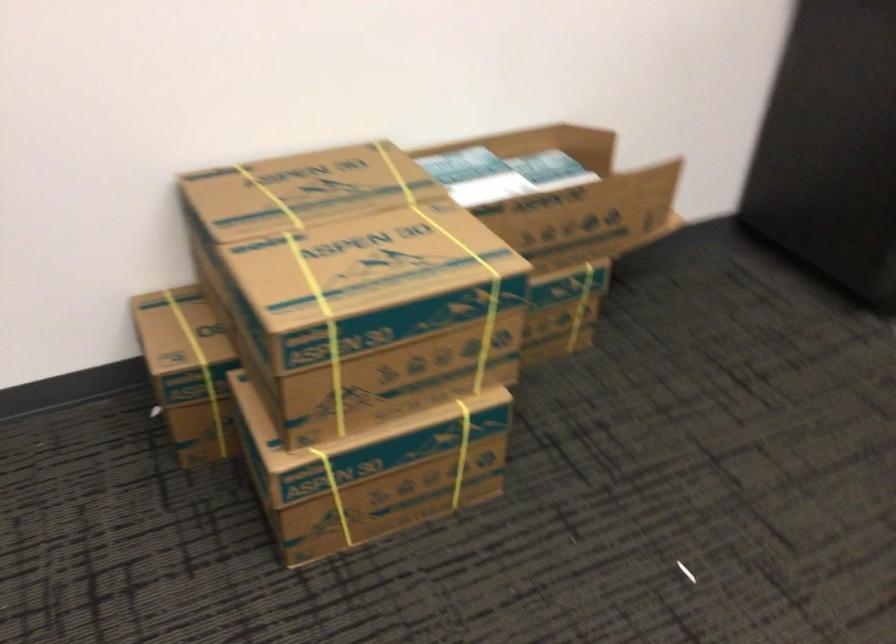
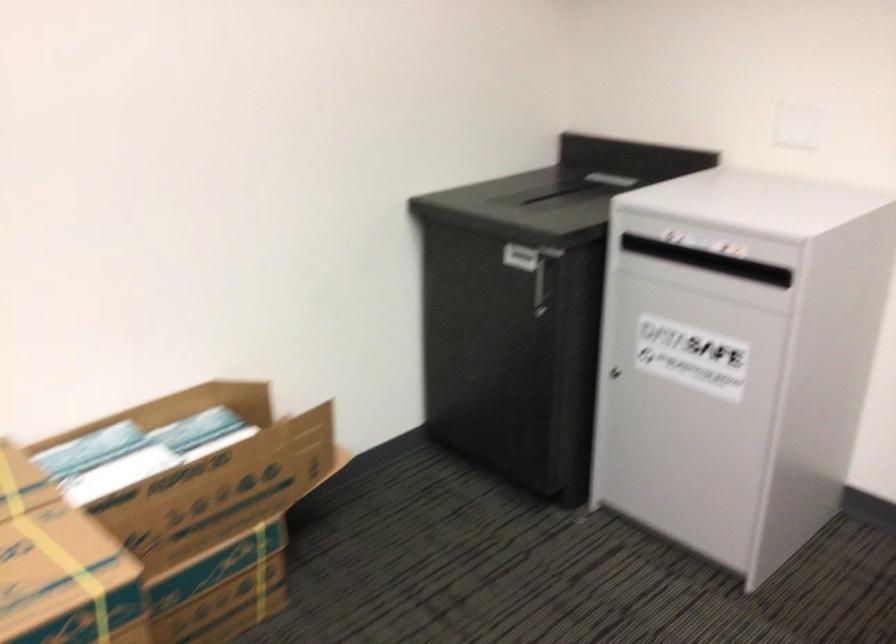
Where in the second image is the point corresponding to (x=487, y=174) from the first image?

(136, 451)